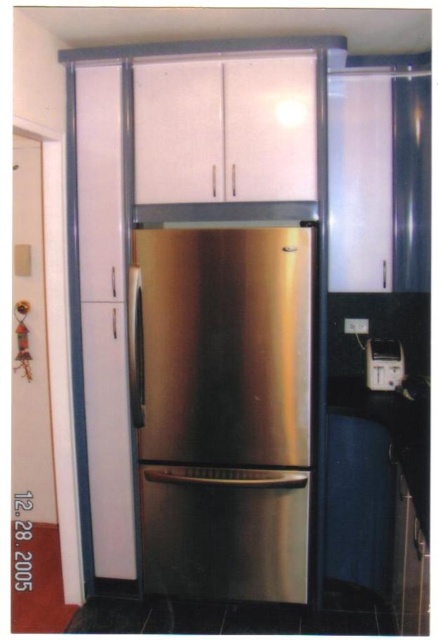
Consider the image. You are organizing the kitchen and want to place a metallic silver toaster at center on the countertop. Given that the stainless steel refrigerator at center is already there, where should you place the toaster relative to the refrigerator?

The stainless steel refrigerator at center is positioned on the left side of the metallic silver toaster at center, so you should place the metallic silver toaster at center to the right of the stainless steel refrigerator at center.

You are planning to place a metallic silver toaster at center on the countertop next to the stainless steel refrigerator at center. Considering their heights, which appliance would you need to adjust in height to ensure they align properly when viewed from the front?

The stainless steel refrigerator at center is taller than the metallic silver toaster at center. To align them properly, you would need to lower the height of the stainless steel refrigerator at center or raise the metallic silver toaster at center.

You are standing in front of the kitchen and want to place a small plant between the two points, point (179, 534) and point (378, 365). Based on their positions, which point is closer to you where you should start placing the plant first?

Point (179, 534) is closer to the viewer than point (378, 365), so you should start placing the plant near point (179, 534) first.